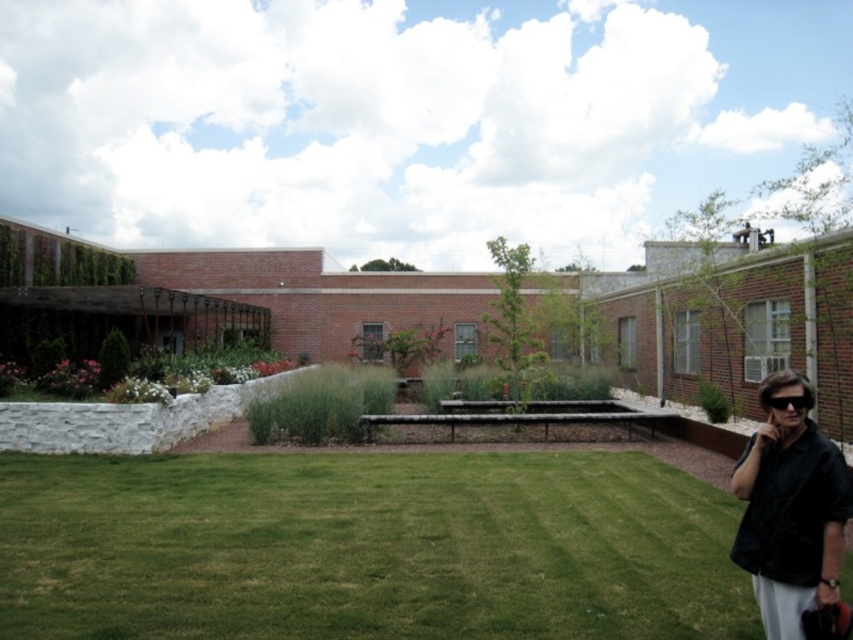
Question: Does green grass at lower center come behind black plastic goggles at lower right?

Choices:
 (A) yes
 (B) no

Answer: (A)

Question: Among these objects, which one is nearest to the camera?

Choices:
 (A) black plastic goggles at lower right
 (B) green grass at lower center

Answer: (A)

Question: Which point is farther from the camera taking this photo?

Choices:
 (A) (561, 483)
 (B) (758, 477)

Answer: (A)

Question: Estimate the real-world distances between objects in this image. Which object is closer to the black matte jacket at lower right?

Choices:
 (A) green grass at lower center
 (B) black plastic goggles at lower right

Answer: (B)

Question: Can you confirm if green grass at lower center is thinner than black matte jacket at lower right?

Choices:
 (A) no
 (B) yes

Answer: (A)

Question: Is green grass at lower center further to the viewer compared to black plastic goggles at lower right?

Choices:
 (A) no
 (B) yes

Answer: (B)